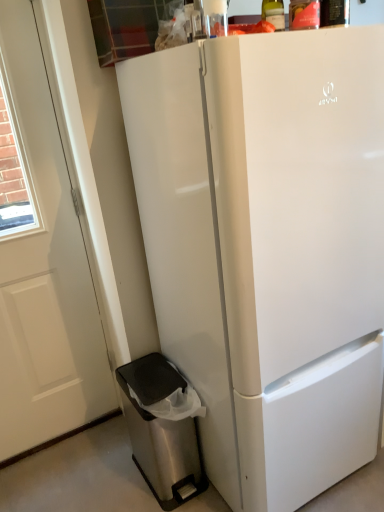
In order to click on free point above stainless steel trash can at lower left (from a real-world perspective) in this screenshot , I will do `click(159, 373)`.